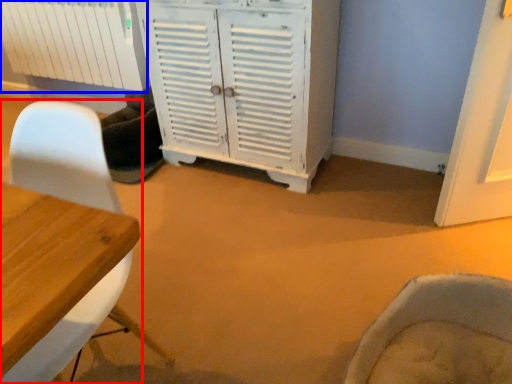
Question: Which object is further to the camera taking this photo, chair (highlighted by a red box) or radiator (highlighted by a blue box)?

Choices:
 (A) chair
 (B) radiator

Answer: (B)